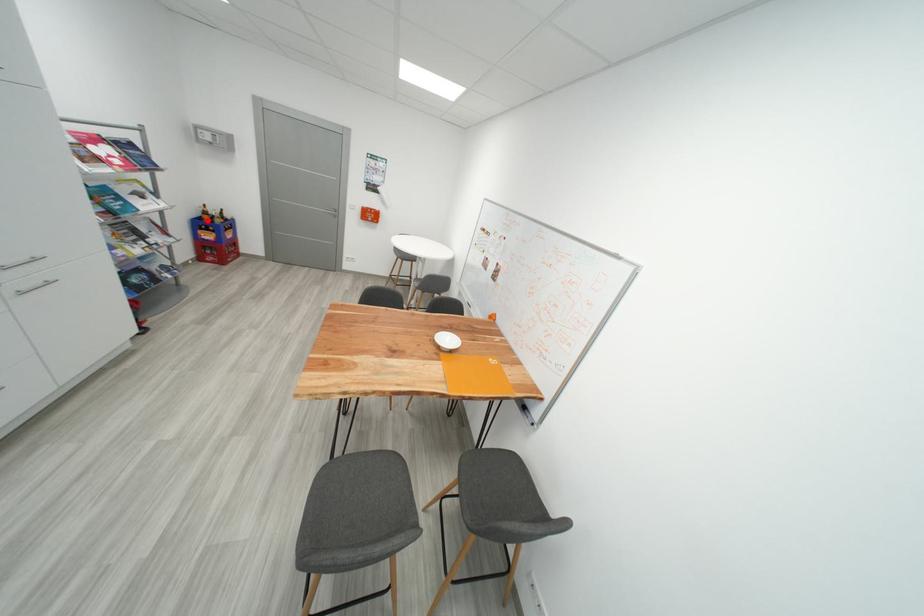
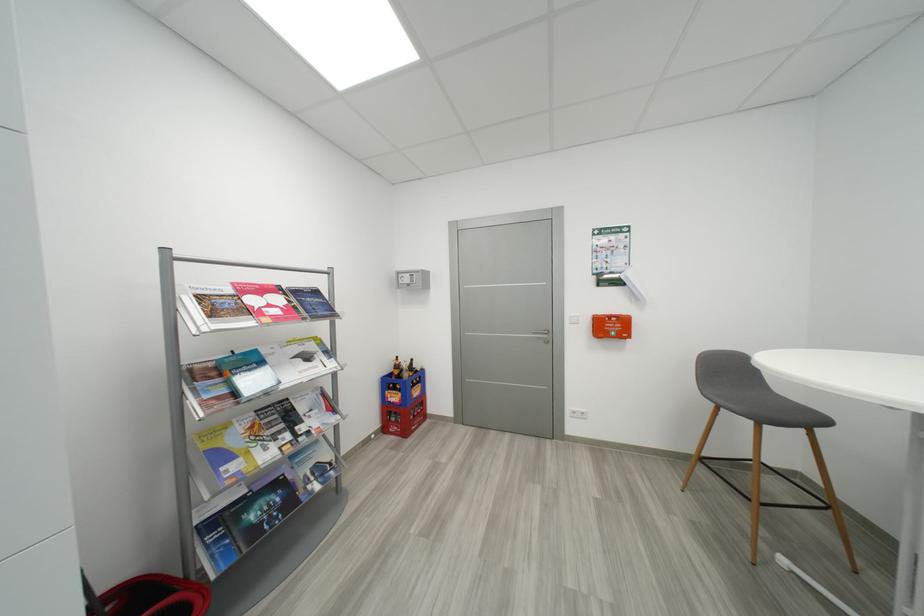
Question: I am providing you with two images of the same scene from different viewpoints. A red point is marked on the first image. Can you still see the location of the red point in image 2?

Choices:
 (A) Yes
 (B) No

Answer: (A)